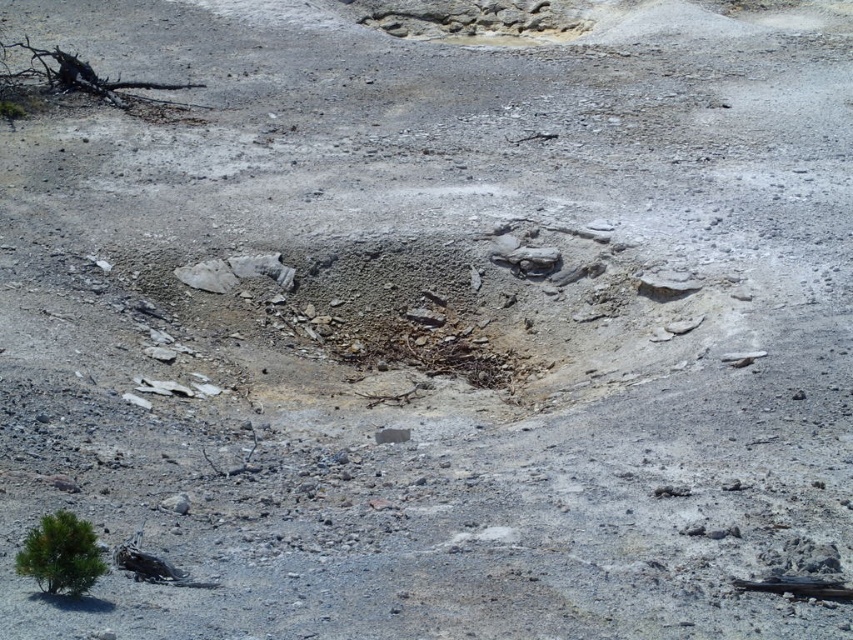
You are a hiker lost in the barren landscape. You see the green matte tree at lower left and the black charred wood at upper left. Which object is nearer to you?

The green matte tree at lower left is closer to the viewer than the black charred wood at upper left.